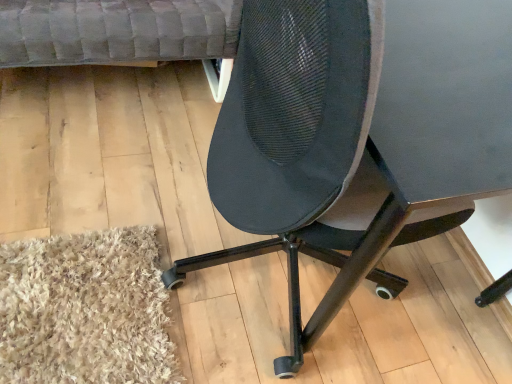
Question: Does velvet grey couch at upper left appear on the right side of black mesh chair at center?

Choices:
 (A) no
 (B) yes

Answer: (A)

Question: Does velvet grey couch at upper left have a greater width compared to black mesh chair at center?

Choices:
 (A) yes
 (B) no

Answer: (A)

Question: Is velvet grey couch at upper left placed right next to black mesh chair at center?

Choices:
 (A) no
 (B) yes

Answer: (A)

Question: Is black mesh chair at center completely or partially inside velvet grey couch at upper left?

Choices:
 (A) no
 (B) yes

Answer: (A)

Question: Does velvet grey couch at upper left have a larger size compared to black mesh chair at center?

Choices:
 (A) yes
 (B) no

Answer: (B)

Question: Does velvet grey couch at upper left have a smaller size compared to black mesh chair at center?

Choices:
 (A) no
 (B) yes

Answer: (B)

Question: Is black mesh chair at center to the left of velvet grey couch at upper left from the viewer's perspective?

Choices:
 (A) no
 (B) yes

Answer: (A)

Question: From a real-world perspective, is black mesh chair at center positioned over velvet grey couch at upper left based on gravity?

Choices:
 (A) yes
 (B) no

Answer: (A)

Question: Would you say black mesh chair at center contains velvet grey couch at upper left?

Choices:
 (A) yes
 (B) no

Answer: (B)

Question: Can you confirm if black mesh chair at center is bigger than velvet grey couch at upper left?

Choices:
 (A) yes
 (B) no

Answer: (A)

Question: Considering the relative sizes of black mesh chair at center and velvet grey couch at upper left in the image provided, is black mesh chair at center smaller than velvet grey couch at upper left?

Choices:
 (A) no
 (B) yes

Answer: (A)

Question: Is black mesh chair at center further to the viewer compared to velvet grey couch at upper left?

Choices:
 (A) no
 (B) yes

Answer: (A)

Question: In terms of height, does velvet grey couch at upper left look taller or shorter compared to black mesh chair at center?

Choices:
 (A) tall
 (B) short

Answer: (B)